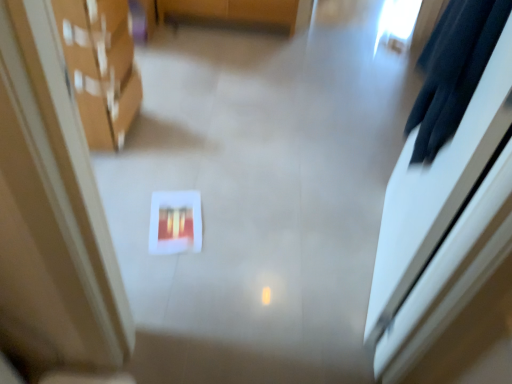
Question: In terms of width, does matte red book at center look wider or thinner when compared to matte cardboard boxes at left?

Choices:
 (A) wide
 (B) thin

Answer: (B)

Question: Is point (178, 193) closer or farther from the camera than point (128, 66)?

Choices:
 (A) farther
 (B) closer

Answer: (B)

Question: Which object is positioned closest to the matte cardboard boxes at left?

Choices:
 (A) matte red book at center
 (B) black fabric robe at upper right

Answer: (A)

Question: Estimate the real-world distances between objects in this image. Which object is closer to the black fabric robe at upper right?

Choices:
 (A) matte cardboard boxes at left
 (B) matte red book at center

Answer: (B)